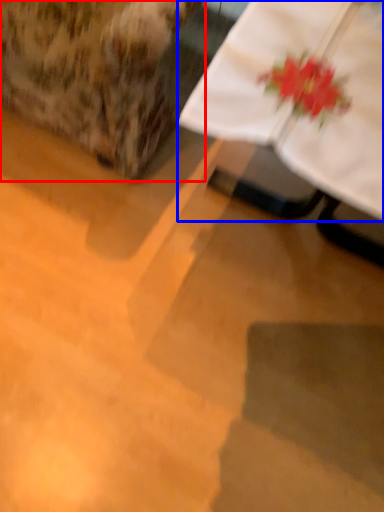
Question: Among these objects, which one is farthest to the camera, armchair (highlighted by a red box) or table (highlighted by a blue box)?

Choices:
 (A) armchair
 (B) table

Answer: (A)